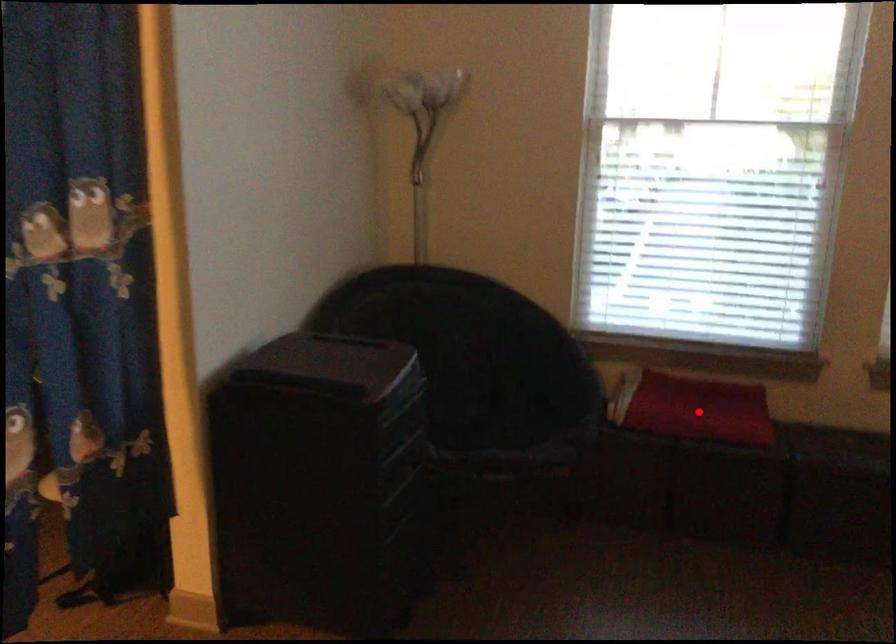
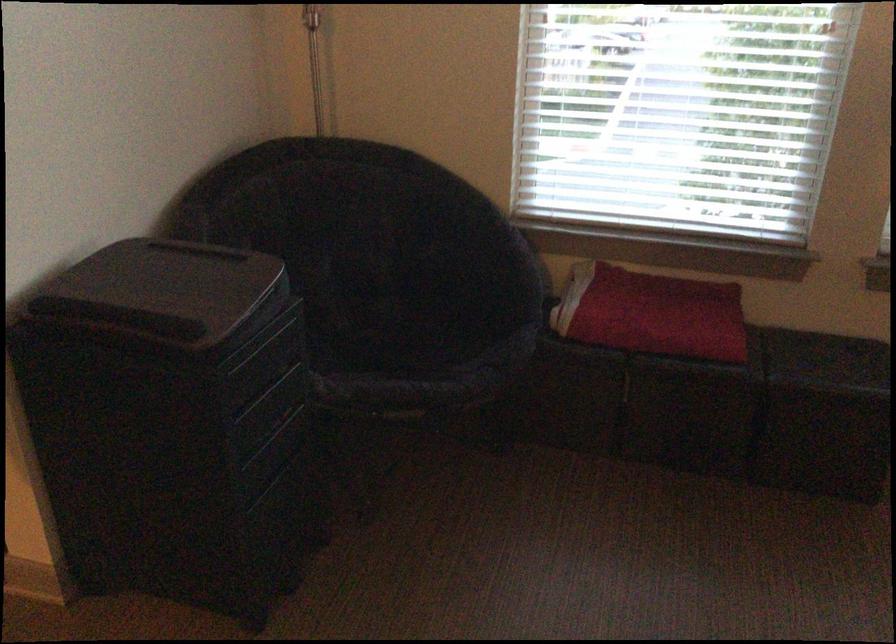
The point at the highlighted location is marked in the first image. Where is the corresponding point in the second image?

(651, 313)